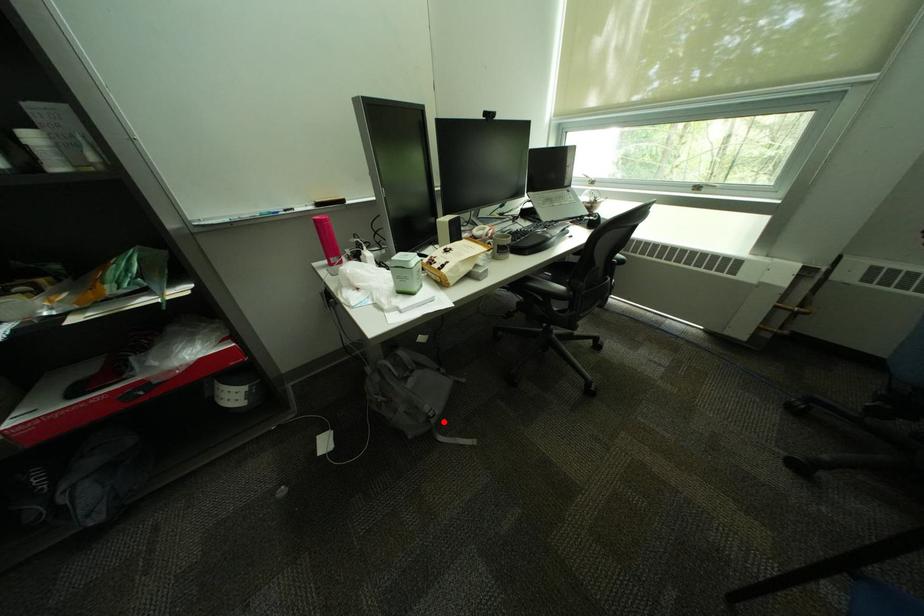
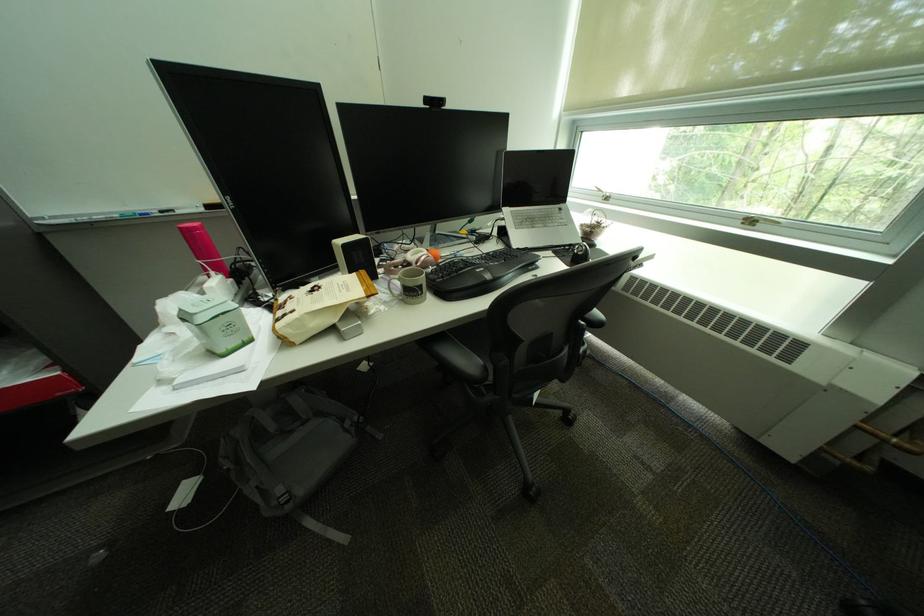
Find the pixel in the second image that matches the highlighted location in the first image.

(299, 508)